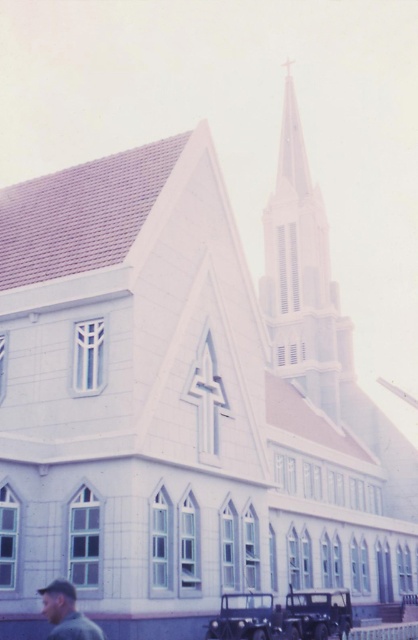
Question: Can you confirm if white stonework spire at upper center is smaller than matte gray shirt at lower left?

Choices:
 (A) no
 (B) yes

Answer: (A)

Question: Which object appears farthest from the camera in this image?

Choices:
 (A) white stonework spire at upper center
 (B) matte gray shirt at lower left

Answer: (A)

Question: Which point is farther to the camera?

Choices:
 (A) (101, 636)
 (B) (306, 369)

Answer: (B)

Question: Which of the following is the farthest from the observer?

Choices:
 (A) (68, 625)
 (B) (295, 259)

Answer: (B)

Question: Is white stonework spire at upper center positioned before matte gray shirt at lower left?

Choices:
 (A) yes
 (B) no

Answer: (B)

Question: Does white stonework spire at upper center appear on the left side of matte gray shirt at lower left?

Choices:
 (A) no
 (B) yes

Answer: (A)